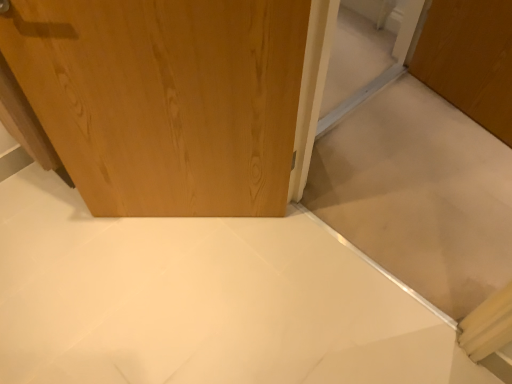
Question: In the image, is wooden door at center on the left side or the right side of wooden door at upper left?

Choices:
 (A) right
 (B) left

Answer: (A)

Question: Is point (418, 206) positioned closer to the camera than point (225, 92)?

Choices:
 (A) farther
 (B) closer

Answer: (A)

Question: Is wooden door at center taller or shorter than wooden door at upper left?

Choices:
 (A) short
 (B) tall

Answer: (B)

Question: From a real-world perspective, is wooden door at upper left above or below wooden door at center?

Choices:
 (A) above
 (B) below

Answer: (B)

Question: Considering the positions of wooden door at upper left and wooden door at center in the image, is wooden door at upper left wider or thinner than wooden door at center?

Choices:
 (A) thin
 (B) wide

Answer: (A)

Question: In terms of height, does wooden door at upper left look taller or shorter compared to wooden door at center?

Choices:
 (A) tall
 (B) short

Answer: (B)

Question: From the image's perspective, is wooden door at upper left located above or below wooden door at center?

Choices:
 (A) above
 (B) below

Answer: (A)